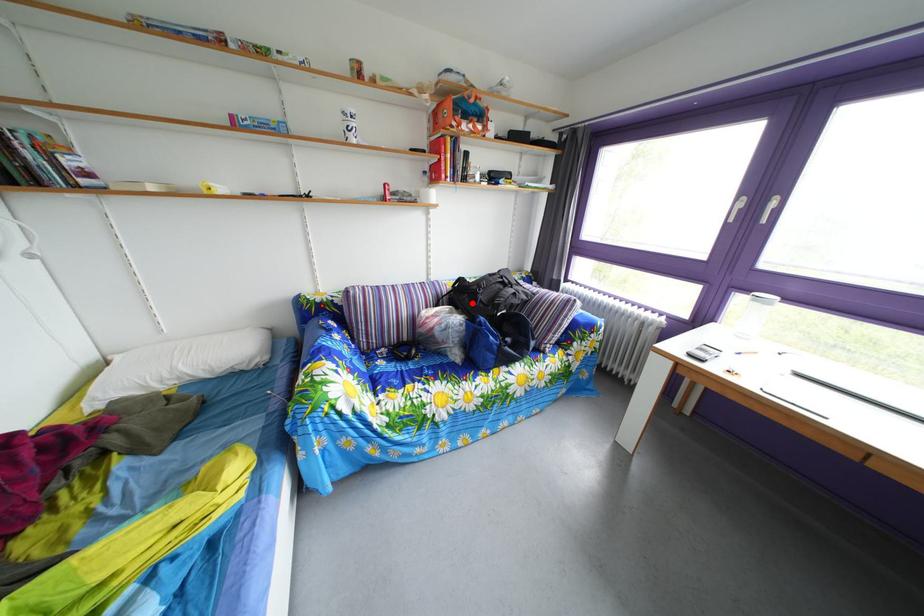
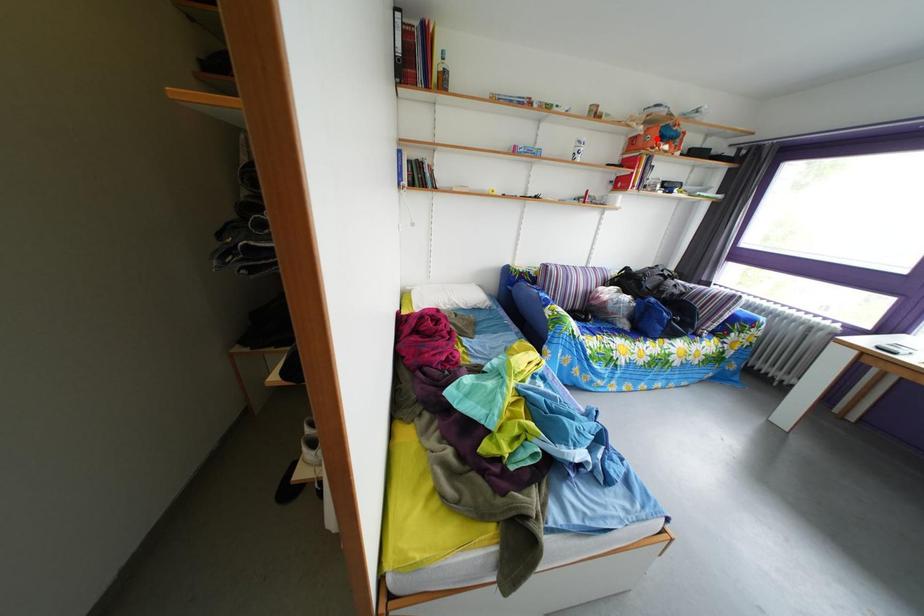
I am providing you with two images of the same scene from different viewpoints. A red point is marked on the first image and another point is marked on the second image. Do the highlighted points in image1 and image2 indicate the same real-world spot?

No